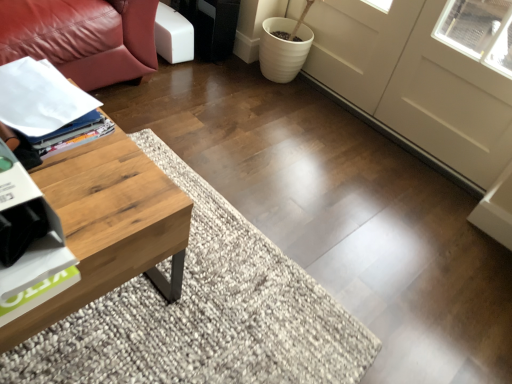
This screenshot has height=384, width=512. I want to click on empty space that is ontop of woodenmaterial/texturecoffee table at left, so click(x=80, y=176).